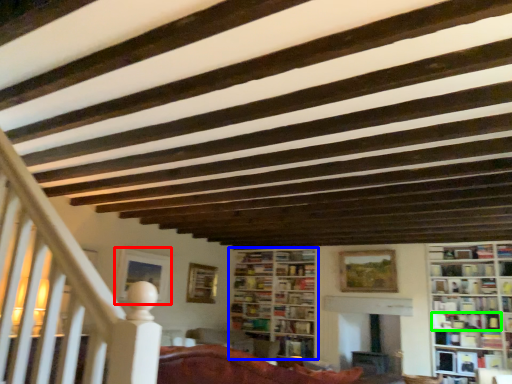
Question: Which object is the closest to the picture frame (highlighted by a red box)? Choose among these: bookcase (highlighted by a blue box) or book (highlighted by a green box).

Choices:
 (A) bookcase
 (B) book

Answer: (A)